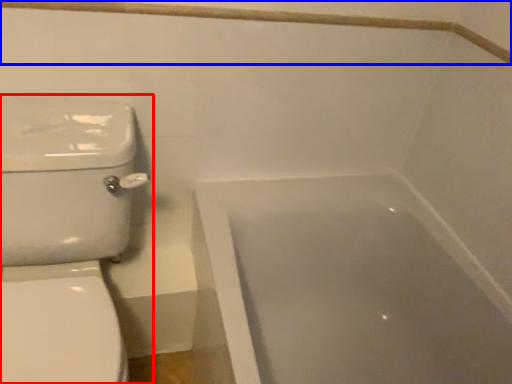
Question: Which point is further to the camera, toilet (highlighted by a red box) or balustrade (highlighted by a blue box)?

Choices:
 (A) toilet
 (B) balustrade

Answer: (B)